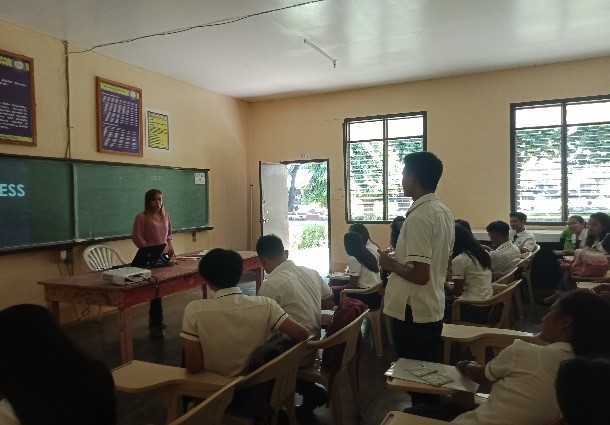
Image resolution: width=610 pixels, height=425 pixels. Identify the location of window. (560, 192).